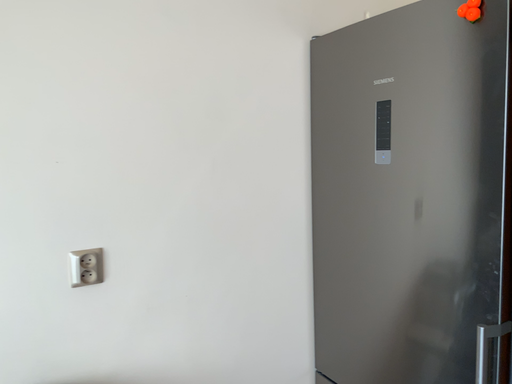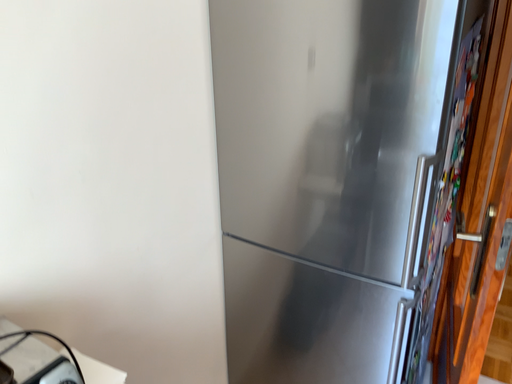
Question: How did the camera likely rotate when shooting the video?

Choices:
 (A) rotated downward
 (B) rotated upward

Answer: (A)